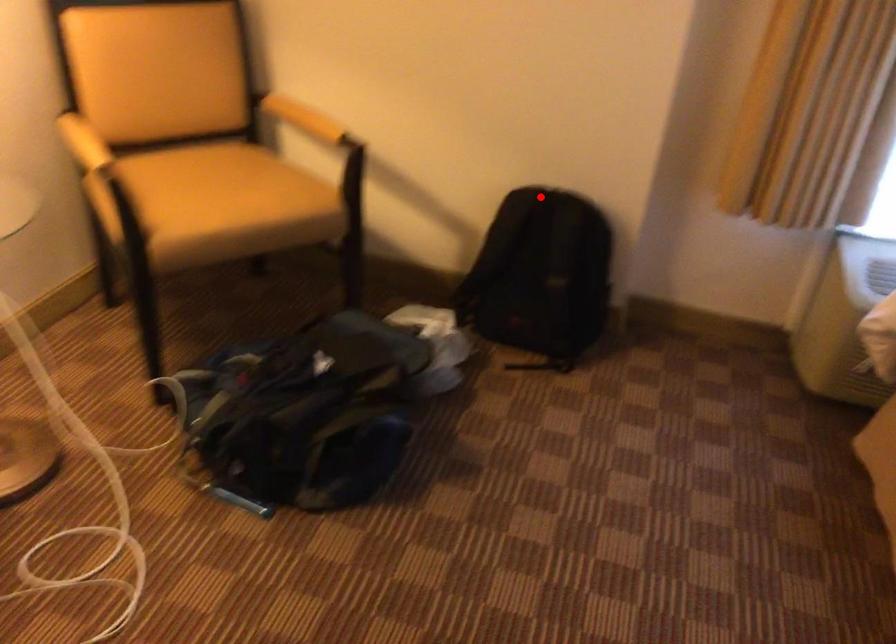
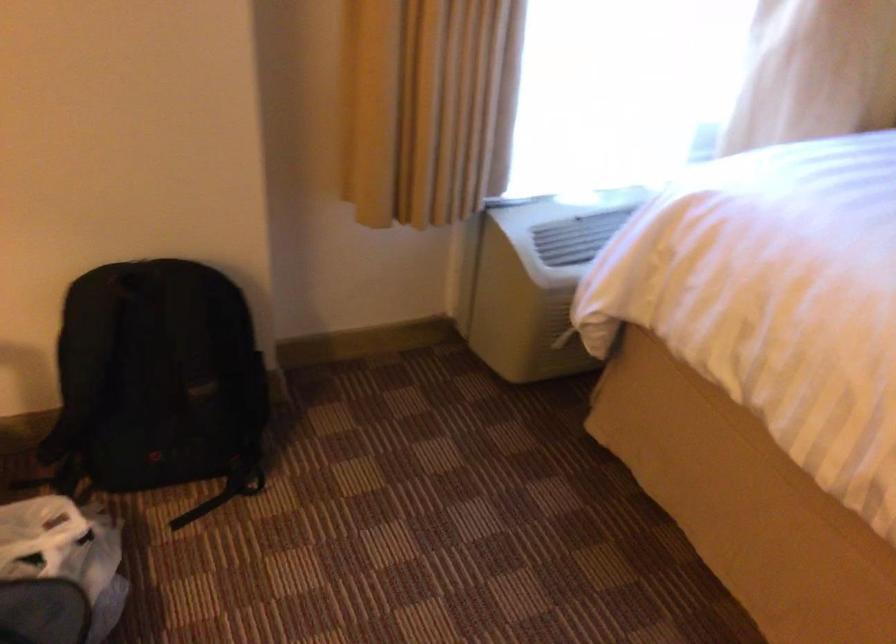
Question: I am providing you with two images of the same scene from different viewpoints. In image1, a red point is highlighted. Considering the same 3D point in image2, which of the following is correct?

Choices:
 (A) It is closer
 (B) It is farther

Answer: (A)